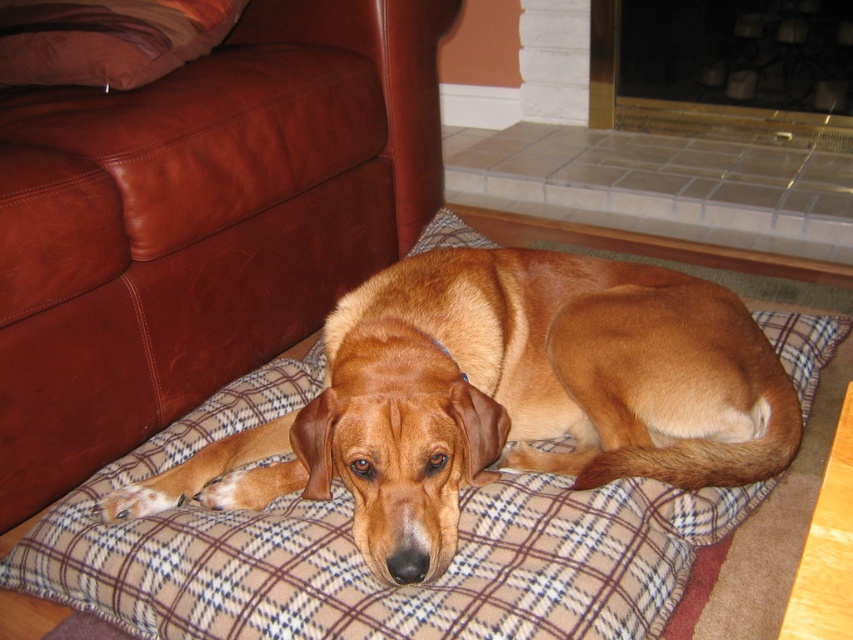
You are a guest in this living room and want to sit down comfortably. Which object, the brown leather couch at left or the brown leather pillow at upper left, would you choose if you prefer a larger seating option?

The brown leather couch at left has a larger size compared to the brown leather pillow at upper left, so you should choose the brown leather couch at left for a larger seating option.

Where is the shiny brown dog at center located in the image coordinates?

The shiny brown dog at center is located at point coordinates of [503,396].